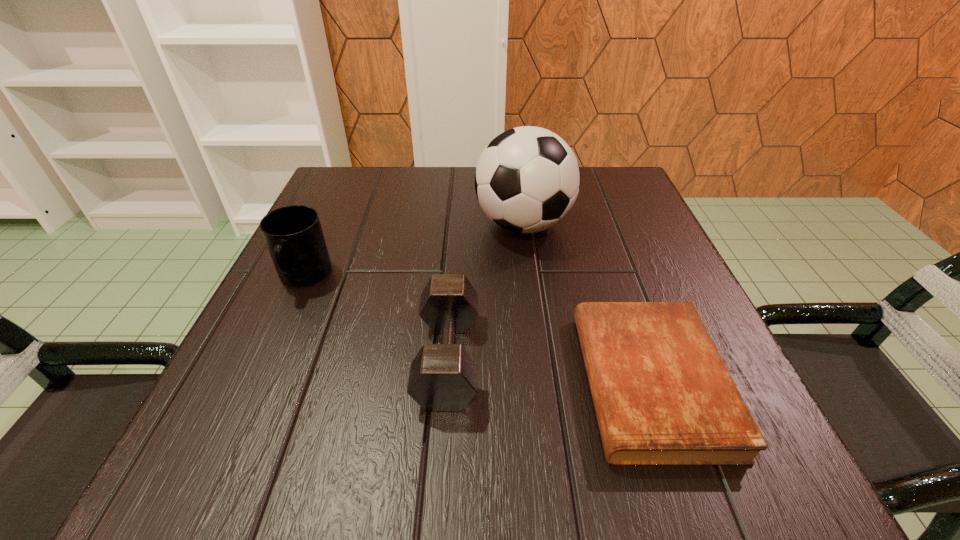
Find the location of a particular element. The image size is (960, 540). free space at the far left corner of the desktop is located at coordinates (375, 209).

Find the location of a particular element. The height and width of the screenshot is (540, 960). vacant space at the near left corner is located at coordinates (289, 442).

In the image, there is a desktop. Where is `vacant space at the far right corner`? The width and height of the screenshot is (960, 540). vacant space at the far right corner is located at coordinates (604, 218).

I want to click on vacant area between the second tallest object and the shortest object, so click(x=477, y=329).

Identify the location of free space between the dumbbell and the Bible. This screenshot has width=960, height=540. click(x=549, y=370).

Identify the location of blank region between the Bible and the dumbbell. (549, 370).

The height and width of the screenshot is (540, 960). Find the location of `empty space that is in between the second shortest object and the Bible`. empty space that is in between the second shortest object and the Bible is located at coordinates (549, 370).

The height and width of the screenshot is (540, 960). I want to click on empty space that is in between the Bible and the leftmost object, so click(x=477, y=329).

Identify the location of free space between the tallest object and the leftmost object. The height and width of the screenshot is (540, 960). (414, 251).

Image resolution: width=960 pixels, height=540 pixels. In order to click on unoccupied area between the soccer ball and the third tallest object in this screenshot , I will do `click(486, 291)`.